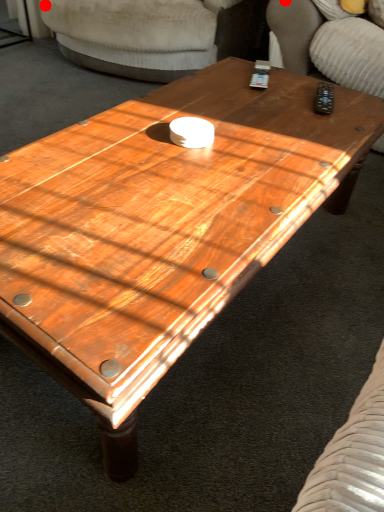
Question: Two points are circled on the image, labeled by A and B beside each circle. Which point is closer to the camera?

Choices:
 (A) A is closer
 (B) B is closer

Answer: (B)